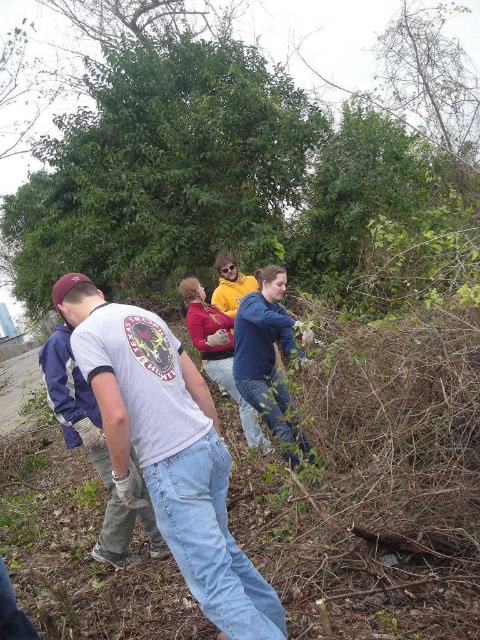
Question: Can you confirm if white cotton t-shirt at center is positioned above green leafy tree at center?

Choices:
 (A) yes
 (B) no

Answer: (B)

Question: Does white cotton t-shirt at center have a lesser width compared to blue denim jeans at center?

Choices:
 (A) no
 (B) yes

Answer: (A)

Question: Estimate the real-world distances between objects in this image. Which object is farther from the white cotton t-shirt at center?

Choices:
 (A) matte yellow sweater at center
 (B) green leafy tree at center
 (C) blue denim jeans at center

Answer: (B)

Question: Which point is closer to the camera?

Choices:
 (A) blue denim jeans at center
 (B) matte yellow sweater at center
 (C) green leafy tree at center

Answer: (A)

Question: From the image, what is the correct spatial relationship of blue denim jeans at center in relation to matte yellow sweater at center?

Choices:
 (A) above
 (B) below

Answer: (A)

Question: Which object is positioned closest to the white cotton t-shirt at center?

Choices:
 (A) matte yellow sweater at center
 (B) green leafy tree at center
 (C) blue denim jeans at center

Answer: (C)